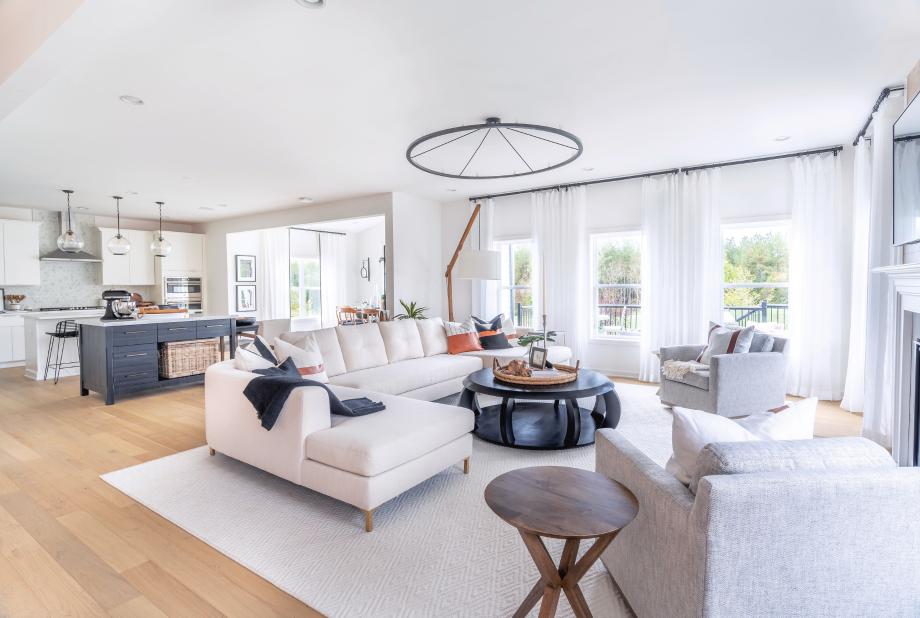
The image size is (920, 618). I want to click on ceiling, so click(282, 82).